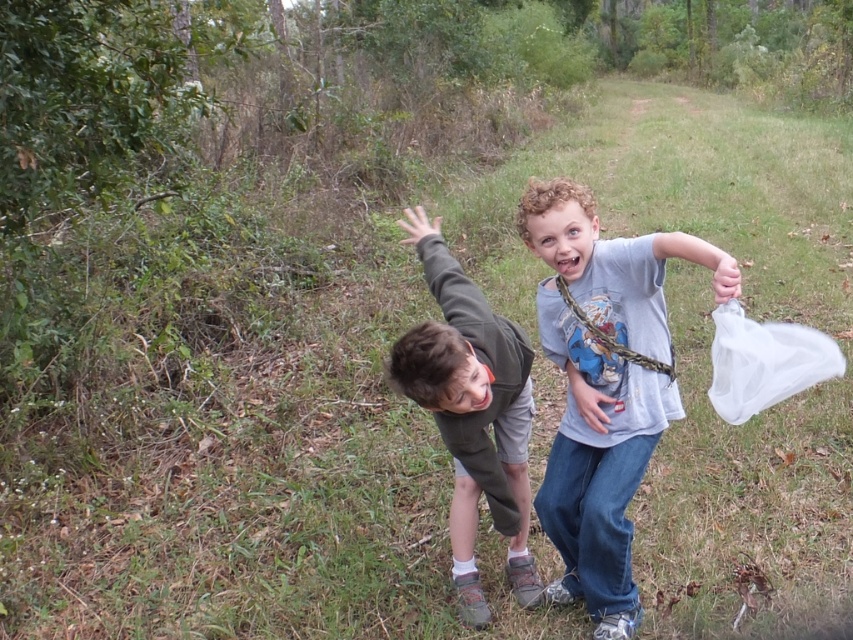
Does dark gray fabric shirt at center have a lesser width compared to transparent plastic bag at right?

No, dark gray fabric shirt at center is not thinner than transparent plastic bag at right.

Is dark gray fabric shirt at center bigger than transparent plastic bag at right?

Yes, dark gray fabric shirt at center is bigger than transparent plastic bag at right.

Which is in front, point (457, 524) or point (717, 396)?

Positioned in front is point (717, 396).

Where is `dark gray fabric shirt at center`? This screenshot has width=853, height=640. dark gray fabric shirt at center is located at coordinates (473, 413).

Who is shorter, gray cotton shirt at center or dark gray fabric shirt at center?

dark gray fabric shirt at center

Can you confirm if gray cotton shirt at center is wider than dark gray fabric shirt at center?

Indeed, gray cotton shirt at center has a greater width compared to dark gray fabric shirt at center.

Is point (608, 372) positioned after point (467, 365)?

Yes, point (608, 372) is behind point (467, 365).

Image resolution: width=853 pixels, height=640 pixels. I want to click on gray cotton shirt at center, so click(x=604, y=385).

Who is positioned more to the left, gray cotton shirt at center or transparent plastic bag at right?

From the viewer's perspective, gray cotton shirt at center appears more on the left side.

Can you confirm if gray cotton shirt at center is shorter than transparent plastic bag at right?

No.

Between point (616, 291) and point (770, 355), which one is positioned in front?

Point (770, 355)

The image size is (853, 640). In order to click on gray cotton shirt at center in this screenshot , I will do [604, 385].